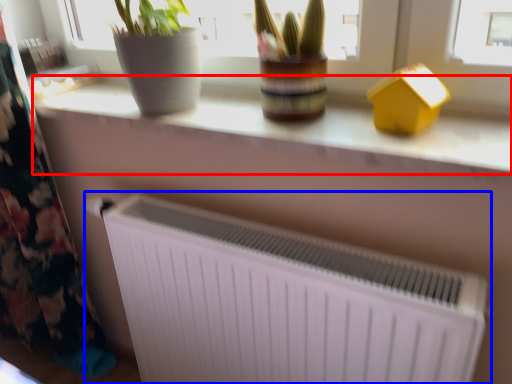
Question: Which object is closer to the camera taking this photo, counter top (highlighted by a red box) or radiator (highlighted by a blue box)?

Choices:
 (A) counter top
 (B) radiator

Answer: (A)